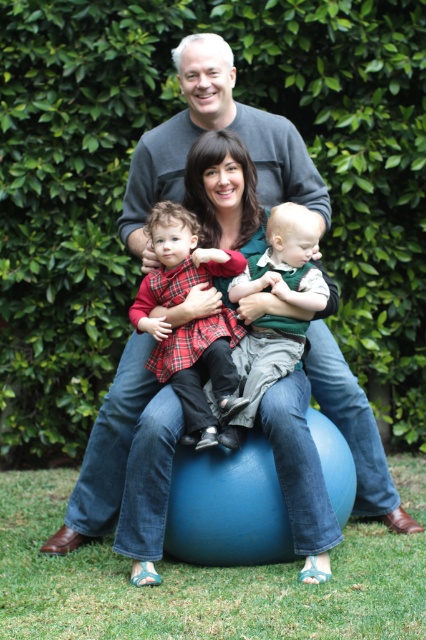
Question: Estimate the real-world distances between objects in this image. Which object is farther from the green cotton shirt at center?

Choices:
 (A) green leafy hedge at upper center
 (B) plaid fabric dress at center

Answer: (A)

Question: Is plaid fabric dress at center bigger than green cotton shirt at center?

Choices:
 (A) no
 (B) yes

Answer: (B)

Question: Can you confirm if green leafy hedge at upper center is thinner than green cotton shirt at center?

Choices:
 (A) yes
 (B) no

Answer: (B)

Question: Among these objects, which one is nearest to the camera?

Choices:
 (A) green leafy hedge at upper center
 (B) green cotton shirt at center

Answer: (B)

Question: Can you confirm if plaid fabric dress at center is positioned below green cotton shirt at center?

Choices:
 (A) yes
 (B) no

Answer: (B)

Question: Which point is farther from the camera taking this photo?

Choices:
 (A) (293, 272)
 (B) (181, 403)
 (C) (402, 150)

Answer: (C)